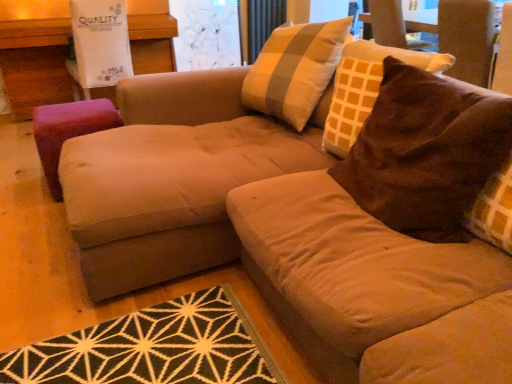
Question: Does transparent glass screen door at upper center have a greater width compared to purple fabric stool at left?

Choices:
 (A) no
 (B) yes

Answer: (A)

Question: Is transparent glass screen door at upper center shorter than purple fabric stool at left?

Choices:
 (A) yes
 (B) no

Answer: (B)

Question: Is transparent glass screen door at upper center thinner than purple fabric stool at left?

Choices:
 (A) no
 (B) yes

Answer: (B)

Question: Would you say transparent glass screen door at upper center is outside purple fabric stool at left?

Choices:
 (A) yes
 (B) no

Answer: (A)

Question: Can you confirm if transparent glass screen door at upper center is positioned to the left of purple fabric stool at left?

Choices:
 (A) yes
 (B) no

Answer: (B)

Question: From the image's perspective, relative to brown suede pillow at upper right, is purple fabric ottoman at left above or below?

Choices:
 (A) below
 (B) above

Answer: (B)

Question: In terms of size, does purple fabric ottoman at left appear bigger or smaller than brown suede pillow at upper right?

Choices:
 (A) small
 (B) big

Answer: (B)

Question: From their relative heights in the image, would you say purple fabric ottoman at left is taller or shorter than brown suede pillow at upper right?

Choices:
 (A) tall
 (B) short

Answer: (A)

Question: Is point (153, 69) closer or farther from the camera than point (431, 185)?

Choices:
 (A) farther
 (B) closer

Answer: (A)

Question: Would you say purple fabric stool at left is to the left or to the right of orange fabric curtain at upper center in the picture?

Choices:
 (A) right
 (B) left

Answer: (B)

Question: From the image's perspective, is purple fabric stool at left above or below orange fabric curtain at upper center?

Choices:
 (A) below
 (B) above

Answer: (A)

Question: Does point (101, 115) appear closer or farther from the camera than point (260, 1)?

Choices:
 (A) farther
 (B) closer

Answer: (B)

Question: Is purple fabric stool at left inside the boundaries of orange fabric curtain at upper center, or outside?

Choices:
 (A) outside
 (B) inside

Answer: (A)

Question: Is orange fabric curtain at upper center taller or shorter than transparent glass screen door at upper center?

Choices:
 (A) tall
 (B) short

Answer: (B)

Question: Choose the correct answer: Is orange fabric curtain at upper center inside transparent glass screen door at upper center or outside it?

Choices:
 (A) inside
 (B) outside

Answer: (B)